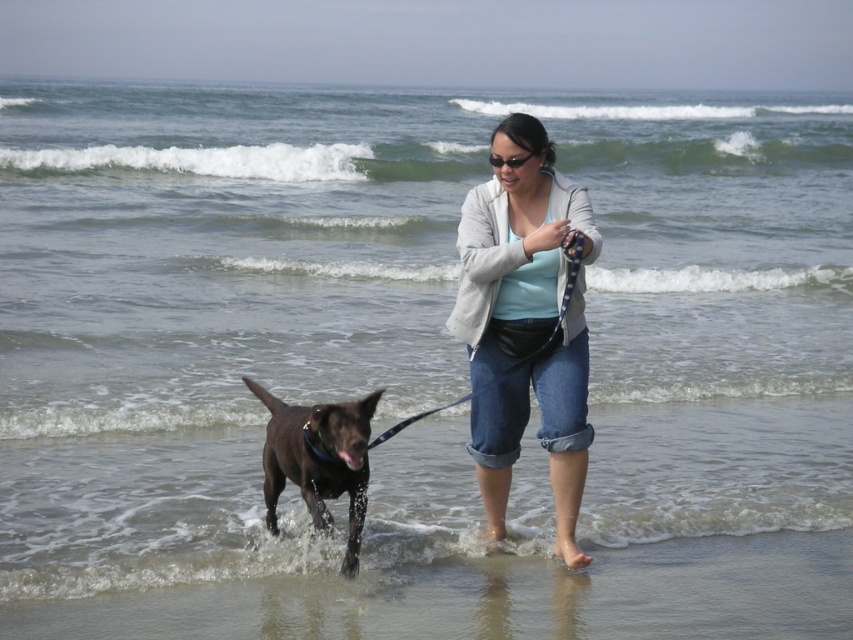
Question: Is shiny brown dog at lower left closer to camera compared to blue fabric leash at center?

Choices:
 (A) no
 (B) yes

Answer: (B)

Question: Which point is farther to the camera?

Choices:
 (A) blue fabric leash at center
 (B) light gray textured jacket at center
 (C) sandy beach at lower center
 (D) shiny brown dog at lower left

Answer: (A)

Question: Which object appears closest to the camera in this image?

Choices:
 (A) blue fabric leash at center
 (B) shiny brown dog at lower left

Answer: (B)

Question: Which of the following is the closest to the observer?

Choices:
 (A) shiny brown dog at lower left
 (B) light gray textured jacket at center

Answer: (A)

Question: Does light gray textured jacket at center appear on the right side of blue fabric leash at center?

Choices:
 (A) yes
 (B) no

Answer: (A)

Question: Can you confirm if shiny brown dog at lower left is bigger than blue fabric leash at center?

Choices:
 (A) yes
 (B) no

Answer: (A)